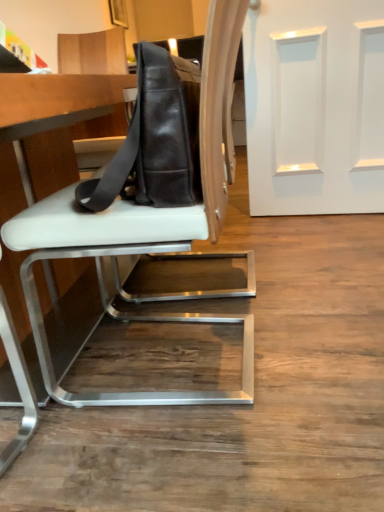
I want to click on vacant region to the left of white leather chair at center, so click(x=71, y=381).